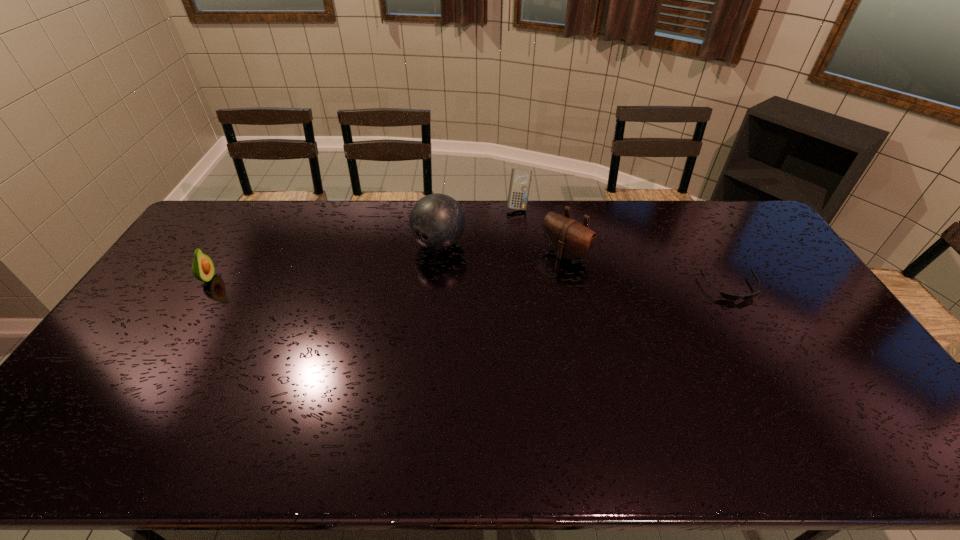
Locate which object is the closest to the farthest object. Please provide its 2D coordinates. Your answer should be formatted as a tuple, i.e. [(x, y)], where the tuple contains the x and y coordinates of a point satisfying the conditions above.

[(568, 238)]